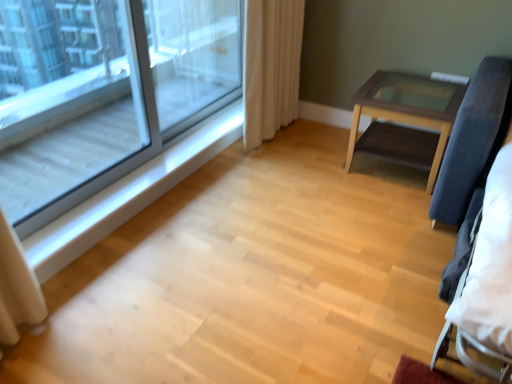
Question: Is white wood at left bigger or smaller than beige fabric curtain at upper right?

Choices:
 (A) big
 (B) small

Answer: (B)

Question: From the image's perspective, relative to beige fabric curtain at upper right, is white wood at left above or below?

Choices:
 (A) above
 (B) below

Answer: (B)

Question: Estimate the real-world distances between objects in this image. Which object is closer to the clear glass window at upper left?

Choices:
 (A) transparent glass screen door at upper left
 (B) wooden glass-top table at right
 (C) beige fabric curtain at upper right
 (D) white wood at left

Answer: (A)

Question: Which object is the farthest from the transparent glass screen door at upper left?

Choices:
 (A) clear glass window at upper left
 (B) white wood at left
 (C) beige fabric curtain at upper right
 (D) wooden glass-top table at right

Answer: (D)